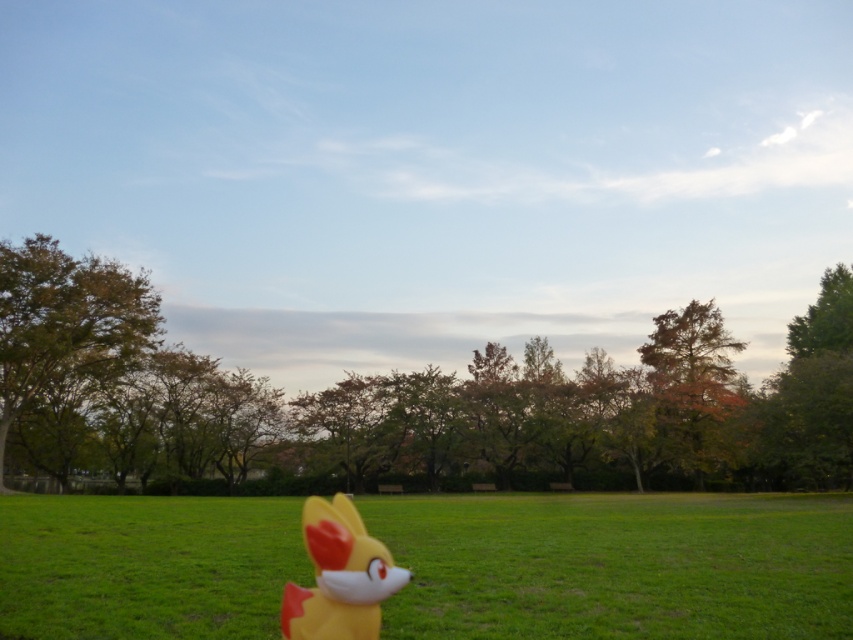
Does brown textured tree at left lie in front of autumn leaves at right?

Yes, brown textured tree at left is closer to the viewer.

Describe the element at coordinates (65, 321) in the screenshot. I see `brown textured tree at left` at that location.

Is point (1, 474) positioned in front of point (735, 349)?

Yes, it is.

Find the location of a particular element. The width and height of the screenshot is (853, 640). brown textured tree at left is located at coordinates (65, 321).

Is green leafy tree at center thinner than yellow matte plush toy at lower center?

No.

Is green leafy tree at center taller than yellow matte plush toy at lower center?

Yes, green leafy tree at center is taller than yellow matte plush toy at lower center.

Is point (718, 483) behind point (303, 625)?

Yes, it is.

Find the location of a particular element. green leafy tree at center is located at coordinates click(x=409, y=403).

Between yellow rubber fox at center and brown textured tree at left, which one appears on the left side from the viewer's perspective?

From the viewer's perspective, brown textured tree at left appears more on the left side.

Is the position of yellow rubber fox at center less distant than that of brown textured tree at left?

Yes, it is in front of brown textured tree at left.

Image resolution: width=853 pixels, height=640 pixels. What are the coordinates of `yellow rubber fox at center` in the screenshot? It's located at (618, 564).